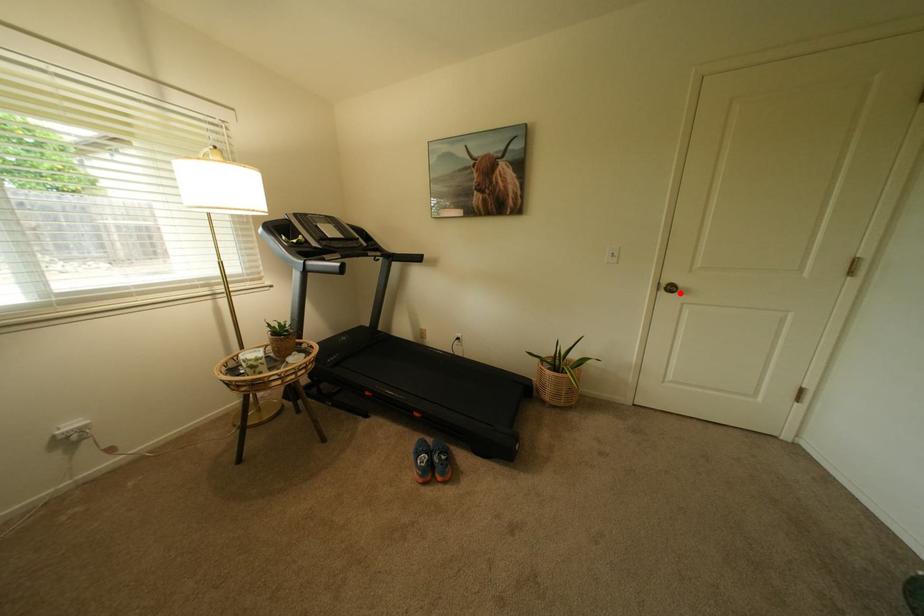
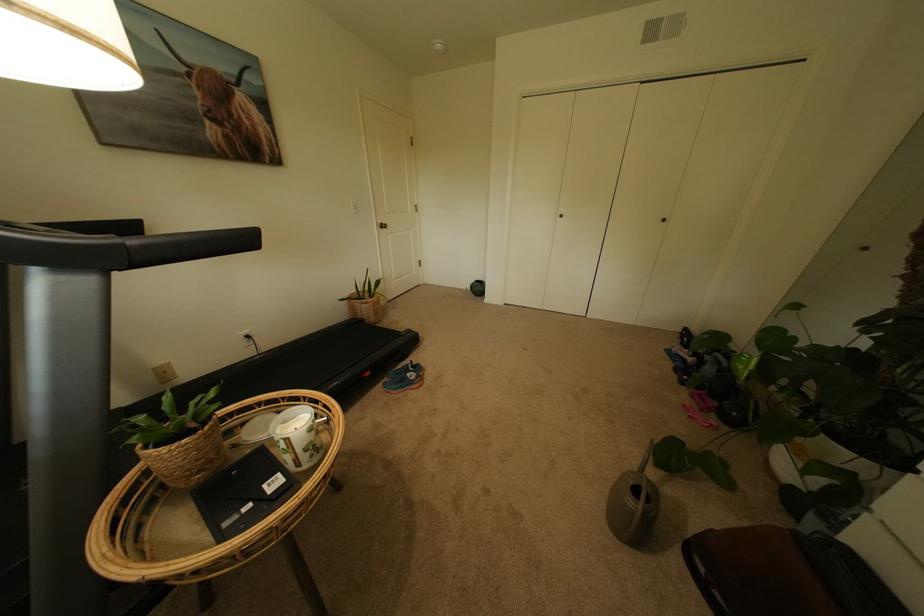
Question: I am providing you with two images of the same scene from different viewpoints. Given a red point in image1, look at the same physical point in image2. Is it:

Choices:
 (A) Closer to the viewpoint
 (B) Farther from the viewpoint

Answer: (A)